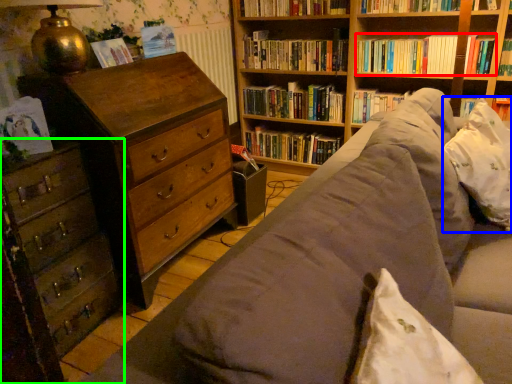
Question: Which object is the farthest from book (highlighted by a red box)? Choose among these: pillow (highlighted by a blue box) or chest of drawers (highlighted by a green box).

Choices:
 (A) pillow
 (B) chest of drawers

Answer: (B)